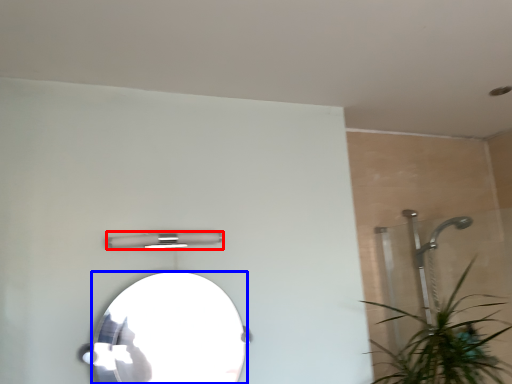
Question: Which point is closer to the camera, light fixture (highlighted by a red box) or mirror (highlighted by a blue box)?

Choices:
 (A) light fixture
 (B) mirror

Answer: (B)